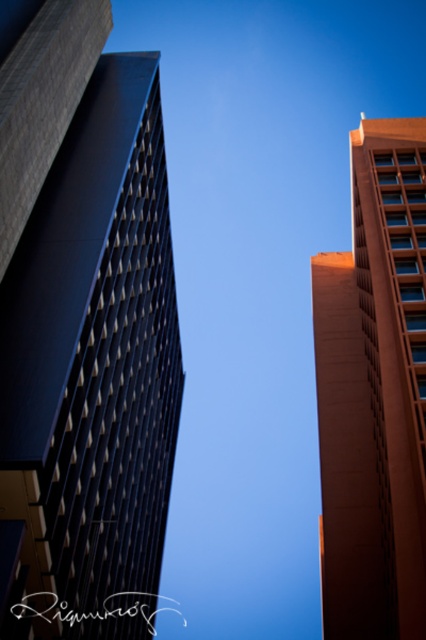
You are standing at the base of the matte black building at left and want to take a photo of it. If your camera can focus on objects up to 25 meters away, will it be able to capture the building clearly?

The matte black building at left is 23.93 meters away from the camera, which is within the camera focus range of up to 25 meters. Therefore, the camera can capture the building clearly.

You are standing on the sidewalk looking up at the two buildings. Which building is closer to you, the matte black building at left or the orange smooth building at upper right?

The matte black building at left is closer to you because it is positioned in front of the orange smooth building at upper right.

You are a drone operator trying to fly a drone from the center of the image to the matte black building at left. What are the coordinates you need to input into your drone control system to reach the building?

The coordinates to input into the drone control system are (83, 326) to reach the matte black building at left.